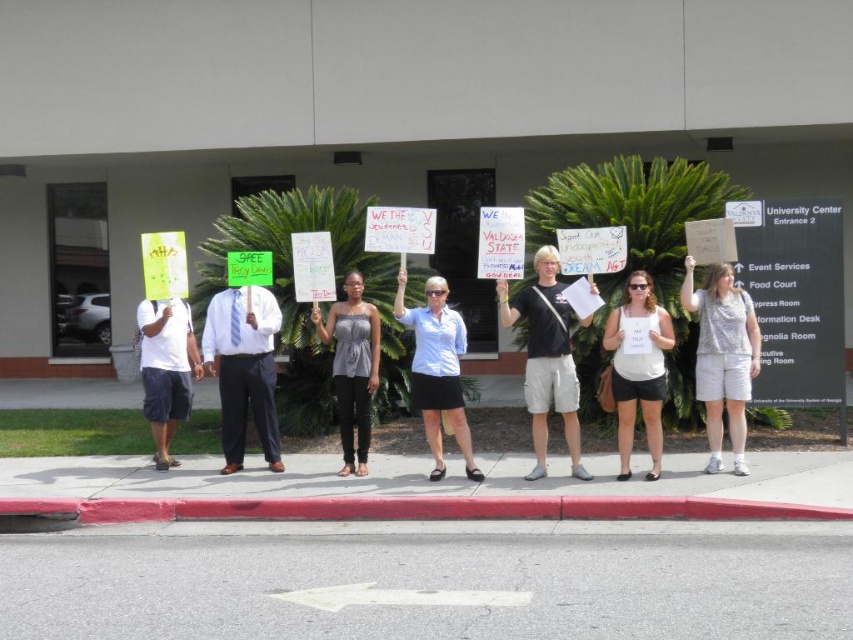
Question: Which point is closer to the camera taking this photo?

Choices:
 (A) (386, 218)
 (B) (350, 403)

Answer: (A)

Question: Does white cotton tank top at center have a greater width compared to white paper sign at center?

Choices:
 (A) yes
 (B) no

Answer: (B)

Question: Is matte gray tank top at center wider than white paper sign at center?

Choices:
 (A) no
 (B) yes

Answer: (A)

Question: Where is white cotton tank top at center located in relation to white paper sign at center in the image?

Choices:
 (A) left
 (B) right

Answer: (B)

Question: Which of the following is the farthest from the observer?

Choices:
 (A) white cotton shorts at center
 (B) white paper sign at center
 (C) matte gray tank top at center

Answer: (C)

Question: Which point is farther to the camera?

Choices:
 (A) matte gray tank top at center
 (B) white cotton shorts at center
 (C) white paper sign at center
 (D) white cotton tank top at center

Answer: (A)